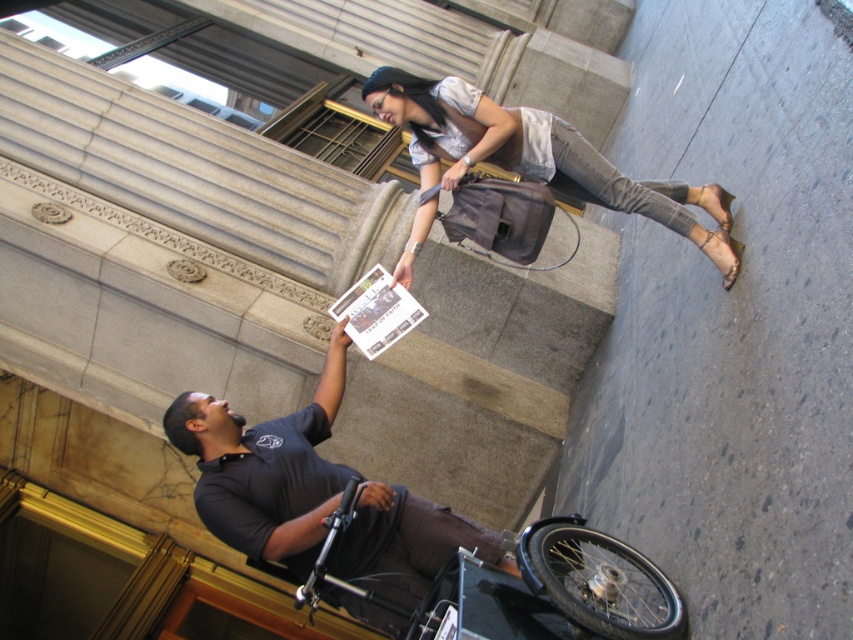
Question: Can you confirm if matte gray bag at upper center is wider than black plastic wheelchair at lower center?

Choices:
 (A) no
 (B) yes

Answer: (B)

Question: Which point appears closest to the camera in this image?

Choices:
 (A) (386, 570)
 (B) (601, 196)

Answer: (A)

Question: Is matte gray bag at upper center thinner than black plastic wheelchair at lower center?

Choices:
 (A) no
 (B) yes

Answer: (A)

Question: Which point is farther from the camera taking this photo?

Choices:
 (A) (558, 145)
 (B) (310, 602)

Answer: (A)

Question: Does dark gray shirt at center appear over black plastic wheelchair at lower center?

Choices:
 (A) yes
 (B) no

Answer: (A)

Question: Which object is closer to the camera taking this photo?

Choices:
 (A) black plastic wheelchair at lower center
 (B) dark gray shirt at center
 (C) matte gray bag at upper center

Answer: (A)